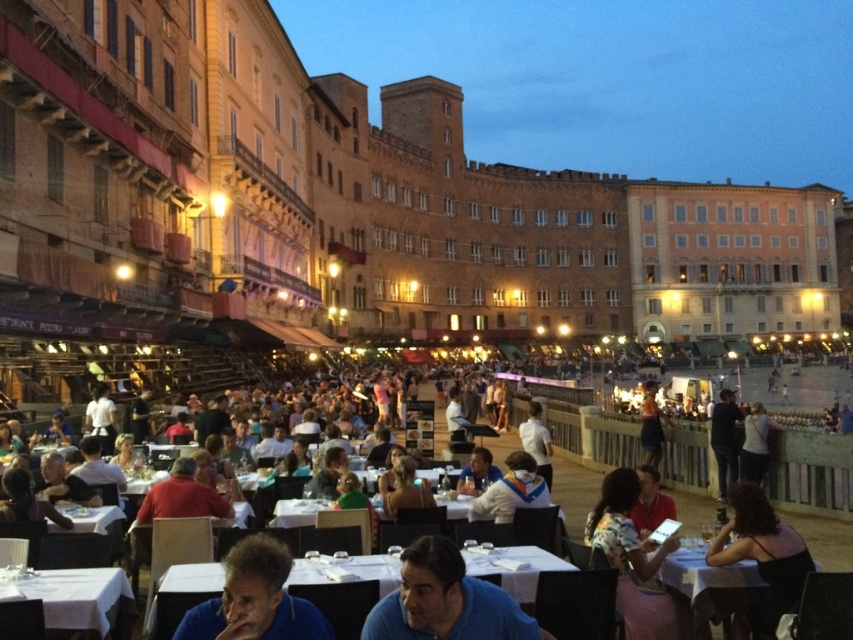
You are standing at the dark brown hair at lower right and want to take a photo of the camera. Given that the optimal distance for a clear photo is 30 meters, can you capture a clear image?

The dark brown hair at lower right and camera are 30.88 meters apart from each other. Since the optimal distance is 30 meters, the distance is slightly beyond the recommended range, so capturing a clear image might be challenging.

You are standing in the historic European square and notice a person wearing a blue fabric shirt at lower center. Can you determine if this person is closer to the foreground or the middle ground of the scene?

The blue fabric shirt at lower center is located at point (254, 600), which places it in the foreground of the scene, closer to the viewer.

You are a photographer standing in the square and want to take a photo of the dark brown hair at lower right and the white glossy table at lower right. Which object is closer to the camera?

The dark brown hair at lower right is positioned over the white glossy table at lower right, so it is closer to the camera.